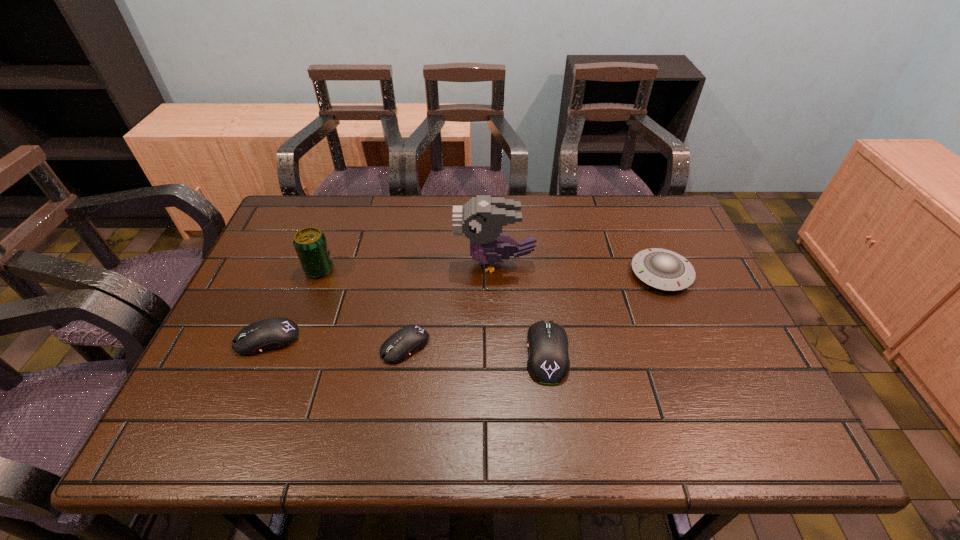
Where is `vacant place for an extra computer equipment on the right`? The height and width of the screenshot is (540, 960). vacant place for an extra computer equipment on the right is located at coordinates tap(693, 360).